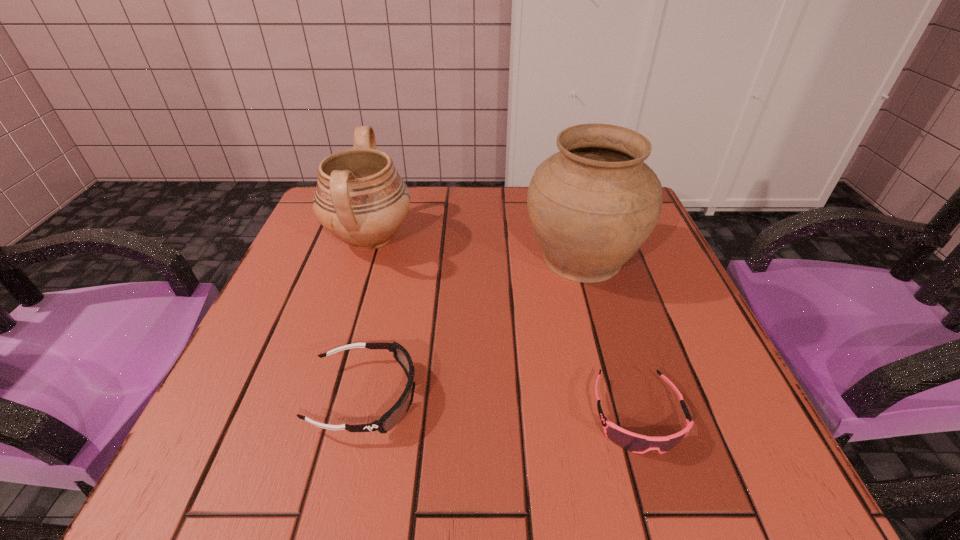
Find the location of a particular element. This screenshot has height=540, width=960. vacant space positioned on the front and sides of the second shortest object is located at coordinates (664, 396).

You are a GUI agent. You are given a task and a screenshot of the screen. Output one action in this format:
    pyautogui.click(x=<x>, y=<y>)
    Task: Click on the urn present at the left edge
    The image size is (960, 540).
    Given the screenshot: What is the action you would take?
    pyautogui.click(x=360, y=198)

Where is `goggles positioned at the left edge`? The width and height of the screenshot is (960, 540). goggles positioned at the left edge is located at coordinates (393, 416).

Find the location of a particular element. The height and width of the screenshot is (540, 960). urn at the right edge is located at coordinates (592, 205).

I want to click on goggles that is at the right edge, so click(x=636, y=443).

The image size is (960, 540). I want to click on object at the far left corner, so click(360, 198).

Locate an element on the screen. The height and width of the screenshot is (540, 960). object that is at the near left corner is located at coordinates (393, 416).

In order to click on object present at the far right corner in this screenshot , I will do `click(592, 205)`.

This screenshot has width=960, height=540. Find the location of `object at the near right corner`. object at the near right corner is located at coordinates (636, 443).

This screenshot has width=960, height=540. Identify the location of free space at the far edge of the desktop. (436, 195).